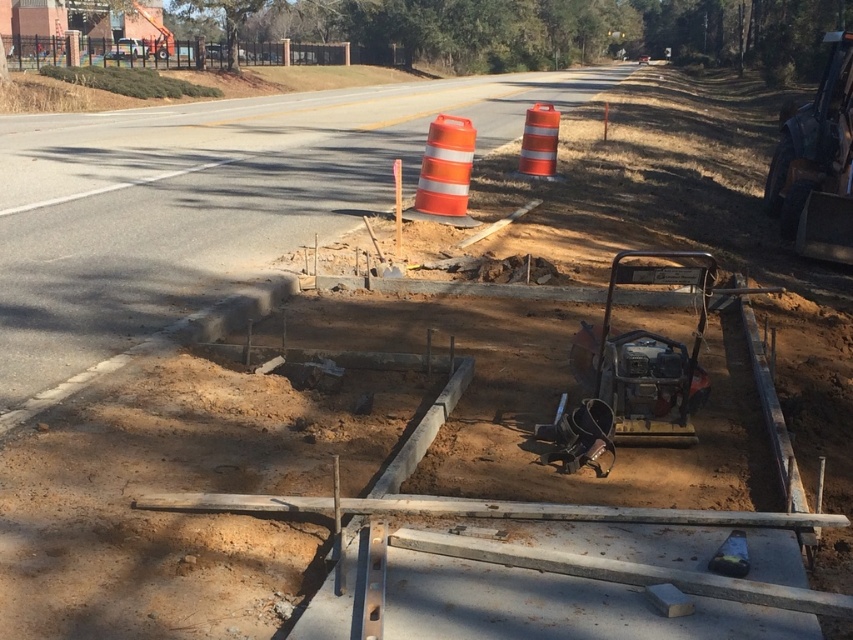
Question: Among these objects, which one is farthest from the camera?

Choices:
 (A) orange reflective cone at upper center
 (B) orange/reflective plastic construction vehicle at upper right
 (C) orange reflective cone at center

Answer: (A)

Question: Which of these objects is positioned closest to the orange/reflective plastic construction vehicle at upper right?

Choices:
 (A) orange reflective cone at center
 (B) orange reflective cone at upper center

Answer: (B)

Question: Observing the image, what is the correct spatial positioning of orange/reflective plastic construction vehicle at upper right in reference to orange reflective cone at upper center?

Choices:
 (A) left
 (B) right

Answer: (B)

Question: Is orange reflective cone at center closer to the viewer compared to orange reflective cone at upper center?

Choices:
 (A) no
 (B) yes

Answer: (B)

Question: Can you confirm if orange/reflective plastic construction vehicle at upper right is positioned above orange reflective cone at center?

Choices:
 (A) yes
 (B) no

Answer: (A)

Question: Which object is closer to the camera taking this photo?

Choices:
 (A) orange/reflective plastic construction vehicle at upper right
 (B) orange reflective cone at upper center

Answer: (A)